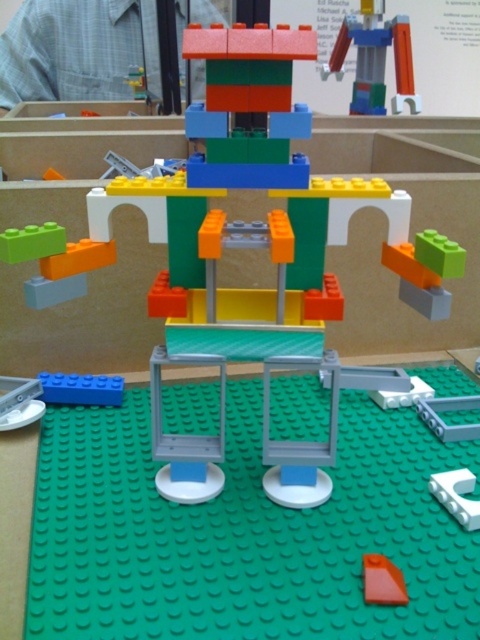
You are a delivery robot that needs to transport a package from the blue matte block at lower left to the brushed metal man at upper left. The package requires a clear path that is at least 2 meters long. Can you safely deliver the package without moving any objects?

The distance between the blue matte block at lower left and the brushed metal man at upper left is 1.86 meters, which is shorter than the required 2 meters. Therefore, the delivery robot cannot safely deliver the package without moving any objects.

You are a LEGO builder who wants to place a new small LEGO brick between the brushed metal man at upper left and the orange matte triangle at center. Considering their sizes, which object will the new brick be closer to?

The new brick will be closer to the orange matte triangle at center because the brushed metal man at upper left is larger in size, meaning the triangle is smaller and thus the brick would need to be placed nearer to it to maintain balance.